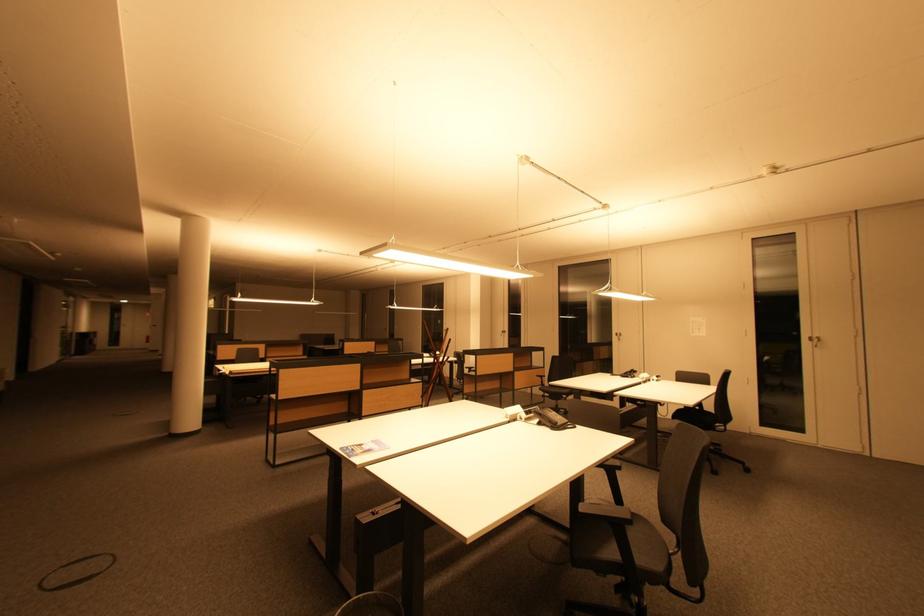
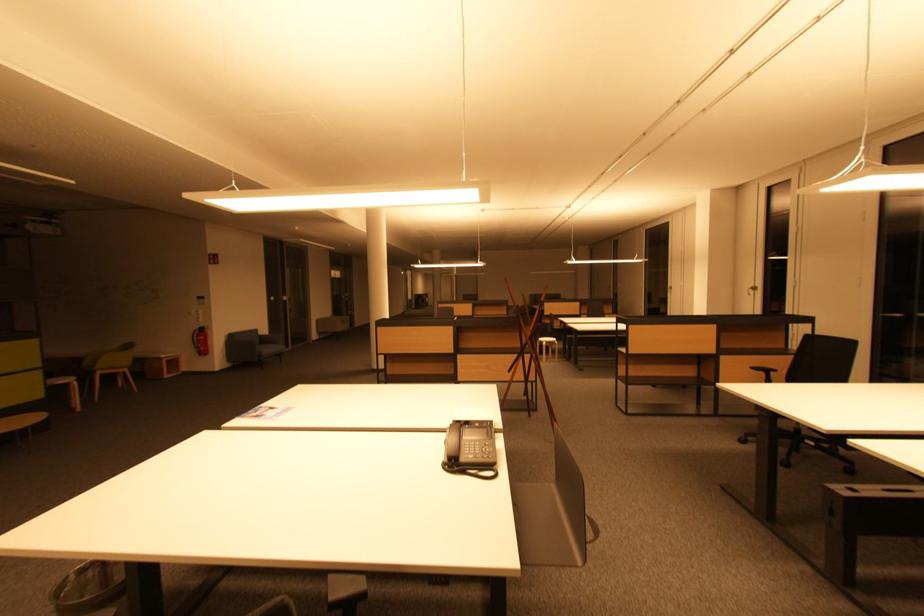
The point at [556,428] is marked in the first image. Where is the corresponding point in the second image?

(450, 463)